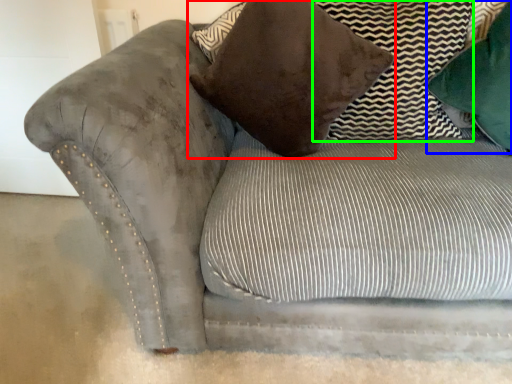
Question: Estimate the real-world distances between objects in this image. Which object is closer to pillow (highlighted by a red box), pillow (highlighted by a blue box) or pillow (highlighted by a green box)?

Choices:
 (A) pillow
 (B) pillow

Answer: (B)